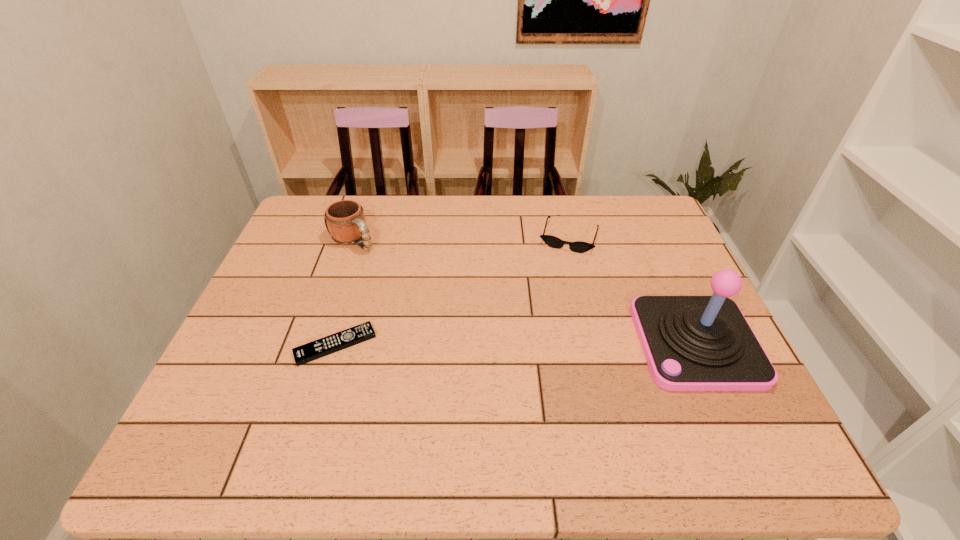
Image resolution: width=960 pixels, height=540 pixels. I want to click on vacant space situated 0.330m on the side of the second tallest object with the handle, so [x=440, y=309].

Where is `vacant space located on the side of the second tallest object with the handle`? This screenshot has height=540, width=960. vacant space located on the side of the second tallest object with the handle is located at coordinates (399, 278).

Image resolution: width=960 pixels, height=540 pixels. Find the location of `vacant space located 0.250m on the side of the second tallest object with the handle`. vacant space located 0.250m on the side of the second tallest object with the handle is located at coordinates (420, 294).

I want to click on free location located on the front-facing side of the sunglasses, so click(x=543, y=323).

In order to click on vacant region located 0.070m on the front-facing side of the sunglasses in this screenshot , I will do `click(559, 270)`.

Image resolution: width=960 pixels, height=540 pixels. I want to click on vacant space located on the front-facing side of the sunglasses, so click(x=551, y=296).

Find the location of a particular element. mug present at the far edge is located at coordinates (346, 224).

Image resolution: width=960 pixels, height=540 pixels. I want to click on sunglasses that is at the far edge, so point(579,247).

The width and height of the screenshot is (960, 540). I want to click on object that is at the near edge, so click(691, 343).

The height and width of the screenshot is (540, 960). Find the location of `remote control at the left edge`. remote control at the left edge is located at coordinates (311, 351).